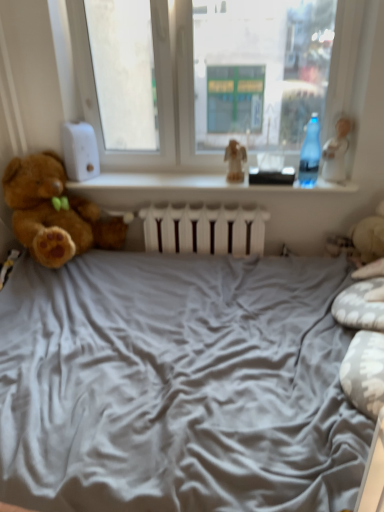
Question: Does white glossy figurine at upper right, which is the 1th toy in right-to-left order, have a lesser width compared to transparent plastic bottle at right?

Choices:
 (A) no
 (B) yes

Answer: (A)

Question: Considering the relative positions of white glossy figurine at upper right, the second toy when ordered from left to right, and transparent plastic bottle at right in the image provided, is white glossy figurine at upper right, the second toy when ordered from left to right, to the right of transparent plastic bottle at right from the viewer's perspective?

Choices:
 (A) no
 (B) yes

Answer: (B)

Question: Is white glossy figurine at upper right, the second toy when ordered from left to right, bigger than transparent plastic bottle at right?

Choices:
 (A) yes
 (B) no

Answer: (A)

Question: Does white glossy figurine at upper right, the second toy when ordered from left to right, have a greater width compared to transparent plastic bottle at right?

Choices:
 (A) yes
 (B) no

Answer: (A)

Question: Is white glossy figurine at upper right, the second toy when ordered from left to right, not within transparent plastic bottle at right?

Choices:
 (A) yes
 (B) no

Answer: (A)

Question: From a real-world perspective, is transparent glass window at center above or below matte brown figurine at center, the 2th toy in the right-to-left sequence?

Choices:
 (A) below
 (B) above

Answer: (B)

Question: Is transparent glass window at center inside the boundaries of matte brown figurine at center, the 2th toy in the right-to-left sequence, or outside?

Choices:
 (A) inside
 (B) outside

Answer: (B)

Question: Looking at their shapes, would you say transparent glass window at center is wider or thinner than matte brown figurine at center, the 1th toy from the left?

Choices:
 (A) thin
 (B) wide

Answer: (B)

Question: Is transparent glass window at center bigger or smaller than matte brown figurine at center, the 1th toy from the left?

Choices:
 (A) big
 (B) small

Answer: (A)

Question: Considering the positions of point (225, 10) and point (4, 192), is point (225, 10) closer or farther from the camera than point (4, 192)?

Choices:
 (A) farther
 (B) closer

Answer: (B)

Question: From a real-world perspective, is transparent glass window at center physically located above or below brown plush teddy bear at left?

Choices:
 (A) below
 (B) above

Answer: (B)

Question: From the image's perspective, is transparent glass window at center above or below brown plush teddy bear at left?

Choices:
 (A) below
 (B) above

Answer: (B)

Question: Is transparent glass window at center in front of or behind brown plush teddy bear at left in the image?

Choices:
 (A) front
 (B) behind

Answer: (B)

Question: In the image, is white glossy figurine at upper right, the second toy when ordered from left to right, positioned in front of or behind transparent glass window at center?

Choices:
 (A) behind
 (B) front

Answer: (A)

Question: In terms of size, does white glossy figurine at upper right, the second toy when ordered from left to right, appear bigger or smaller than transparent glass window at center?

Choices:
 (A) small
 (B) big

Answer: (A)